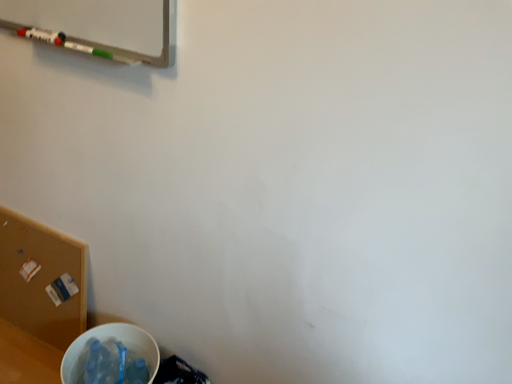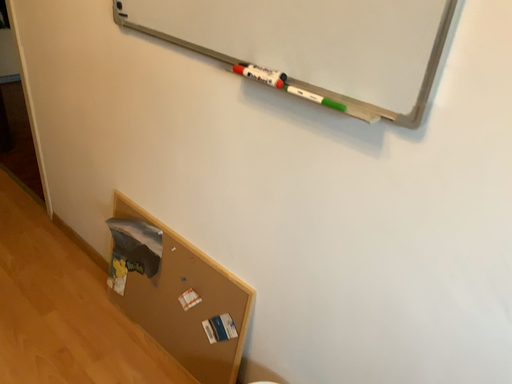
Question: Which way did the camera rotate in the video?

Choices:
 (A) rotated right
 (B) rotated left

Answer: (B)